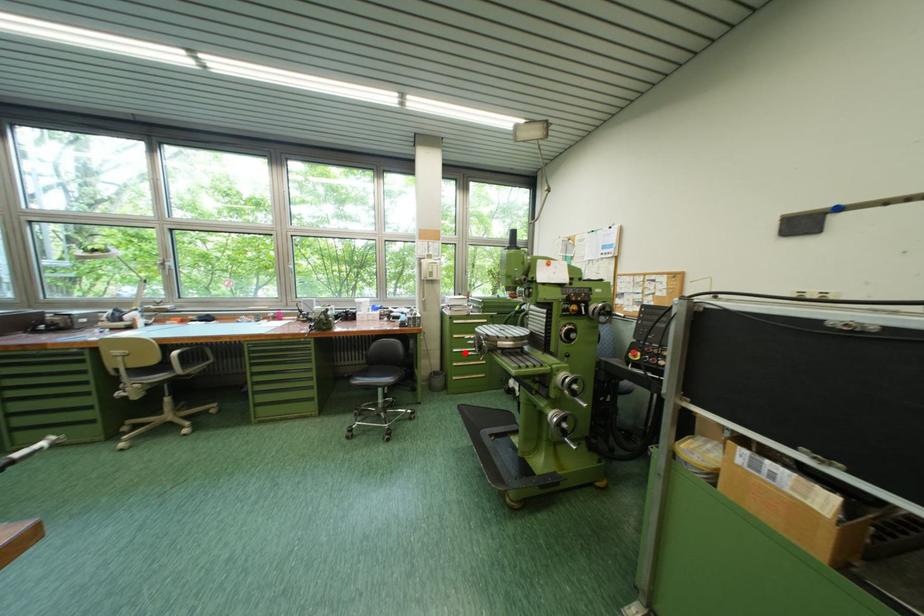
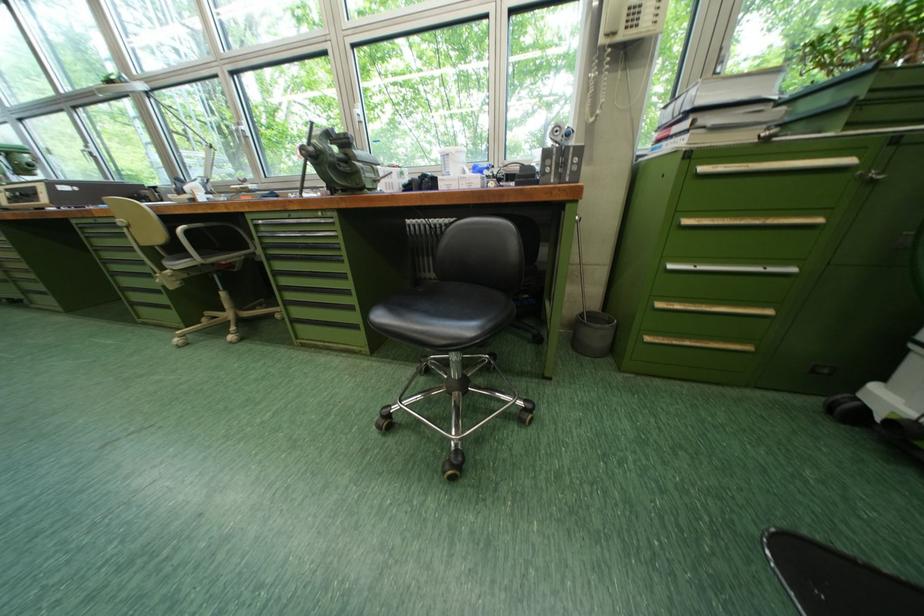
Question: I am providing you with two images of the same scene from different viewpoints. In image1, a red point is highlighted. Considering the same 3D point in image2, which of the following is correct?

Choices:
 (A) It is closer
 (B) It is farther

Answer: (A)